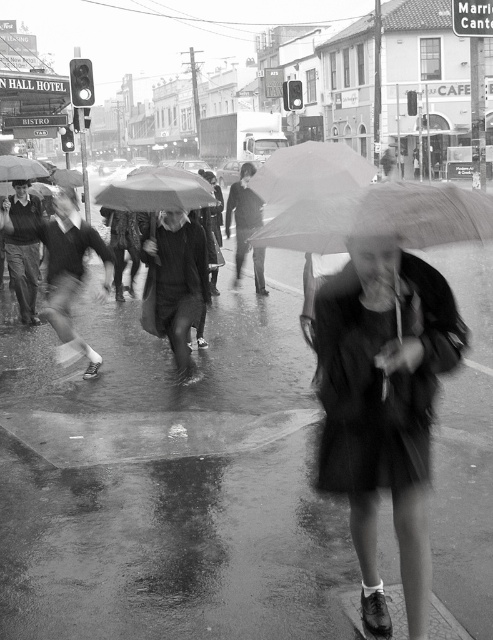
Can you confirm if dark fabric umbrella at center is shorter than leather jacket at center?

No, dark fabric umbrella at center is not shorter than leather jacket at center.

Is dark fabric umbrella at center bigger than leather jacket at center?

Actually, dark fabric umbrella at center might be smaller than leather jacket at center.

Describe the element at coordinates (175, 284) in the screenshot. The height and width of the screenshot is (640, 493). I see `dark fabric umbrella at center` at that location.

This screenshot has width=493, height=640. What are the coordinates of `dark fabric umbrella at center` in the screenshot? It's located at (175, 284).

Is matte black sweater at left below dark gray fabric jacket at center?

Yes.

Between matte black sweater at left and dark gray fabric jacket at center, which one appears on the right side from the viewer's perspective?

Positioned to the right is dark gray fabric jacket at center.

The width and height of the screenshot is (493, 640). What are the coordinates of `matte black sweater at left` in the screenshot? It's located at (66, 266).

Between point (413, 376) and point (210, 250), which one is positioned in front?

Point (413, 376)

Can you confirm if black matte coat at center is bigger than matte black umbrella at center?

Yes.

The width and height of the screenshot is (493, 640). What do you see at coordinates (384, 406) in the screenshot?
I see `black matte coat at center` at bounding box center [384, 406].

You are a GUI agent. You are given a task and a screenshot of the screen. Output one action in this format:
    pyautogui.click(x=<x>, y=<y>)
    Task: Click on the black matte coat at center
    This screenshot has height=640, width=493.
    Given the screenshot: What is the action you would take?
    pyautogui.click(x=384, y=406)